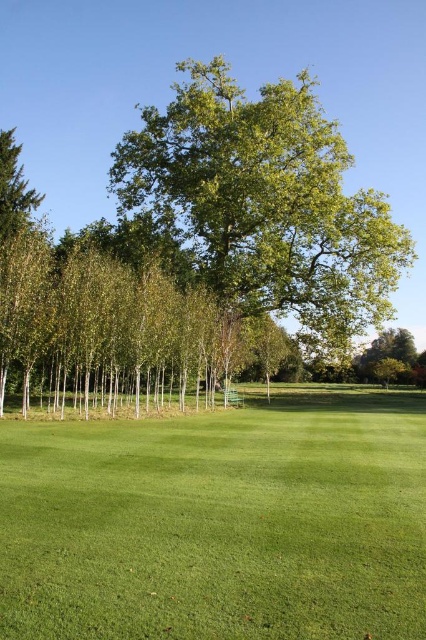
You are a gardener who wants to plant a new flower bed between the green grass at lower center and the green leafy tree at center. Considering their heights, which one will the flowers be taller than?

The green grass at lower center is shorter than the green leafy tree at center. Since flowers are typically taller than grass but shorter than trees, the flowers will be taller than the green grass at lower center but shorter than the green leafy tree at center.

You are planning to place a picnic blanket on the green grass at lower center. Considering the size of the green leafy tree at center, will the tree provide enough shade for the blanket?

The green grass at lower center is smaller than the green leafy tree at center, which means the tree is larger and likely casts a broader shadow. Therefore, the green leafy tree at center should provide sufficient shade for the picnic blanket placed on the green grass at lower center.

You are standing on the green grass at lower center and want to walk to the green leafy tree at center. Which direction should you move to reach it?

The green grass at lower center is positioned on the left side of green leafy tree at center, so you should move to the right to reach the tree.